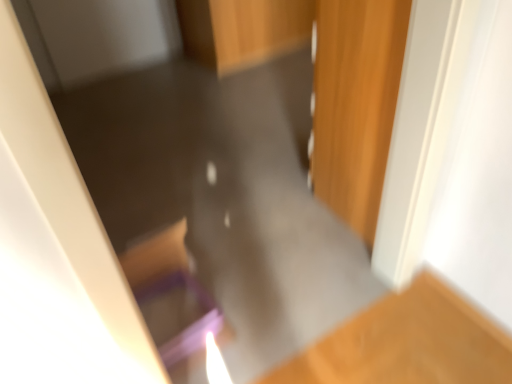
Describe the element at coordinates (356, 104) in the screenshot. I see `wooden door at right` at that location.

What is the approximate width of wooden door at right?

17.28 inches.

This screenshot has width=512, height=384. Find the location of `wooden door at right`. wooden door at right is located at coordinates (356, 104).

Where is `wooden door at right`? This screenshot has height=384, width=512. wooden door at right is located at coordinates (356, 104).